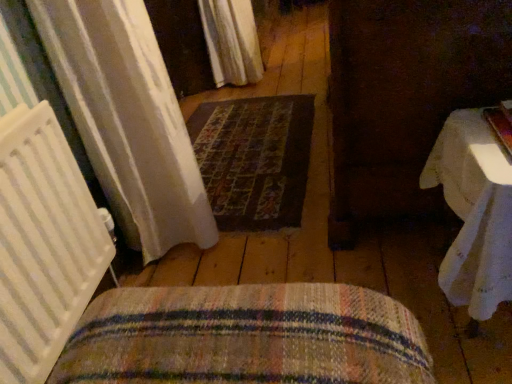
Question: From the image's perspective, is white sheer curtain at upper center positioned above or below woven fabric cushion at lower center?

Choices:
 (A) below
 (B) above

Answer: (B)

Question: Is white sheer curtain at upper center to the left or to the right of woven fabric cushion at lower center in the image?

Choices:
 (A) right
 (B) left

Answer: (A)

Question: Which object is positioned closest to the white cloth-covered table at right?

Choices:
 (A) woven fabric cushion at lower center
 (B) dark brown woven mat at center
 (C) white sheer curtain at upper center

Answer: (A)

Question: Estimate the real-world distances between objects in this image. Which object is farther from the white cloth-covered table at right?

Choices:
 (A) woven fabric cushion at lower center
 (B) white sheer curtain at upper center
 (C) dark brown woven mat at center

Answer: (B)